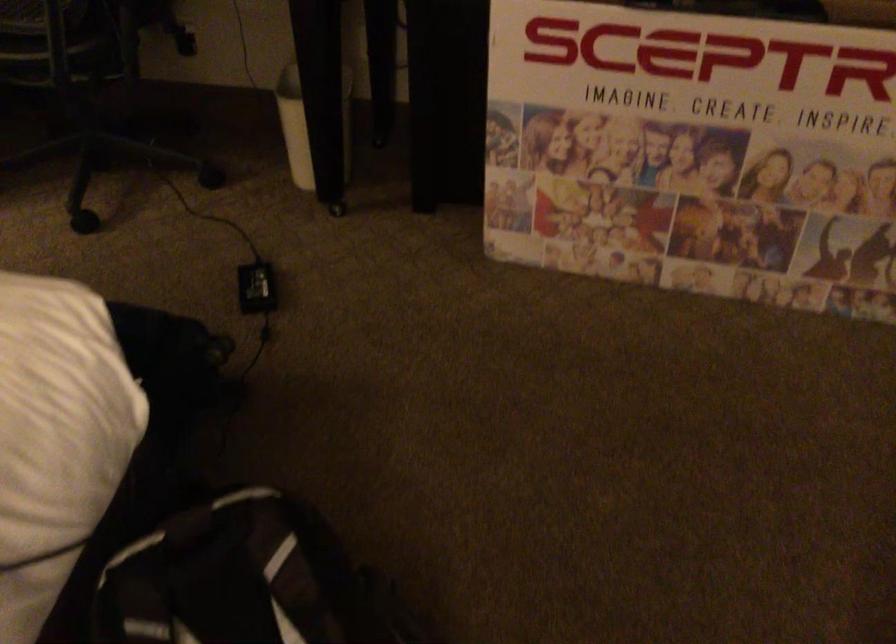
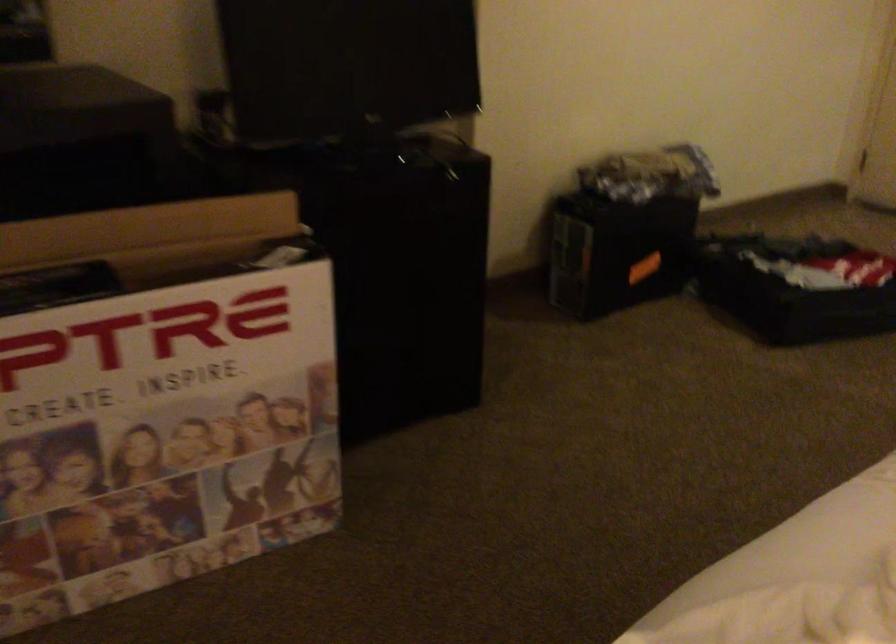
Question: The camera is either moving clockwise (left) or counter-clockwise (right) around the object. The first image is from the beginning of the video and the second image is from the end. Is the camera moving left or right when shooting the video?

Choices:
 (A) Left
 (B) Right

Answer: (A)